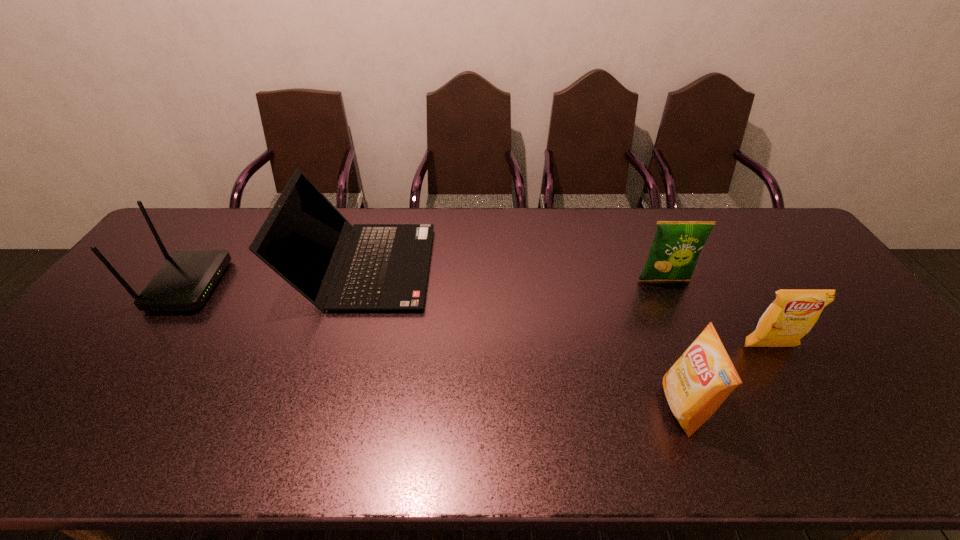
The width and height of the screenshot is (960, 540). Identify the location of free space located on the front-facing side of the nearest crisp (potato chip). (547, 407).

The image size is (960, 540). What are the coordinates of `vacant space located 0.290m on the front-facing side of the nearest crisp (potato chip)` in the screenshot? It's located at (539, 407).

Find the location of a particular element. The height and width of the screenshot is (540, 960). vacant area situated on the front of the second farthest crisp (potato chip) with the logo is located at coordinates (804, 406).

Locate an element on the screen. object at the far edge is located at coordinates (336, 266).

Find the location of `object that is at the near edge`. object that is at the near edge is located at coordinates (703, 377).

This screenshot has height=540, width=960. Find the location of `object that is at the left edge`. object that is at the left edge is located at coordinates (183, 283).

Where is `free space at the far edge`? The width and height of the screenshot is (960, 540). free space at the far edge is located at coordinates (639, 223).

The image size is (960, 540). Identify the location of vacant area at the near edge. (581, 440).

Where is `vacant area at the left edge`? vacant area at the left edge is located at coordinates (82, 373).

Image resolution: width=960 pixels, height=540 pixels. I want to click on blank space at the far right corner of the desktop, so click(732, 211).